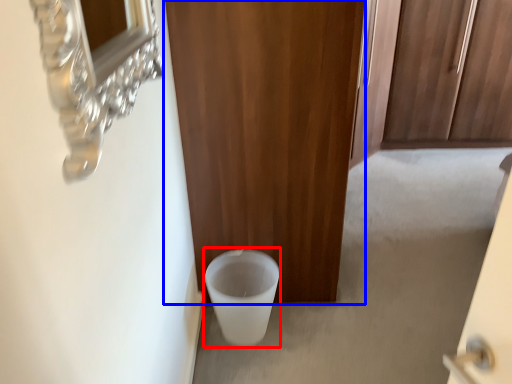
Question: Which point is further to the camera, toilet bowl (highlighted by a red box) or door (highlighted by a blue box)?

Choices:
 (A) toilet bowl
 (B) door

Answer: (A)